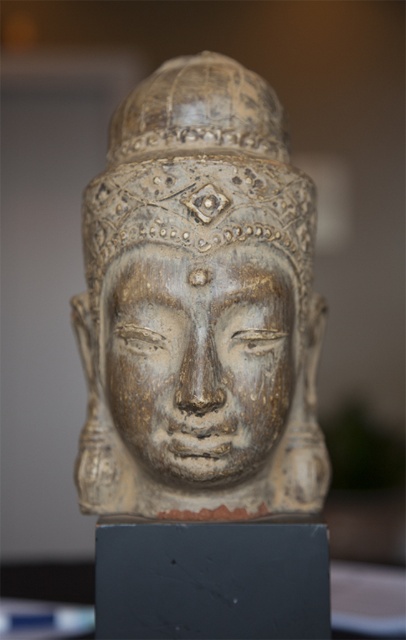
Question: Is golden carved head at center to the left of golden carved face at center from the viewer's perspective?

Choices:
 (A) yes
 (B) no

Answer: (B)

Question: Among these points, which one is farthest from the camera?

Choices:
 (A) (220, 252)
 (B) (138, 406)

Answer: (B)

Question: Can you confirm if golden carved head at center is positioned to the right of golden carved face at center?

Choices:
 (A) yes
 (B) no

Answer: (A)

Question: Is golden carved head at center closer to camera compared to golden carved face at center?

Choices:
 (A) yes
 (B) no

Answer: (A)

Question: Which point is closer to the camera?

Choices:
 (A) golden carved face at center
 (B) golden carved head at center

Answer: (B)